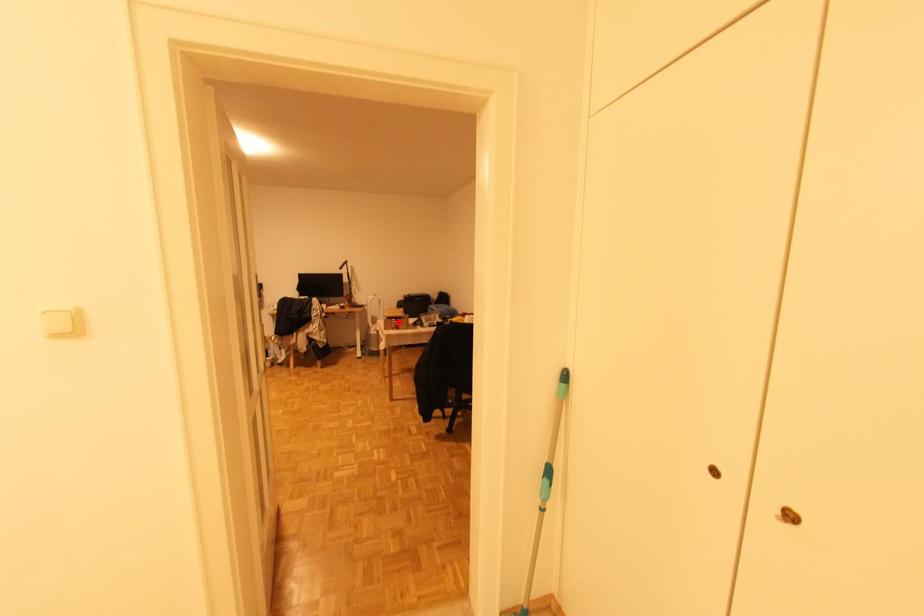
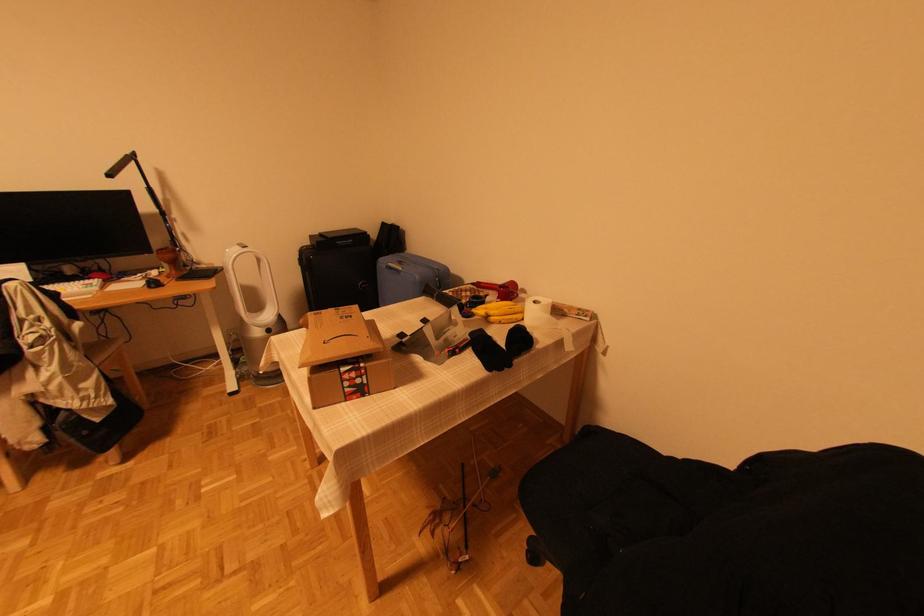
Question: I am providing you with two images of the same scene from different viewpoints. In image1, a red point is highlighted. Considering the same 3D point in image2, which of the following is correct?

Choices:
 (A) It is closer
 (B) It is farther

Answer: (B)